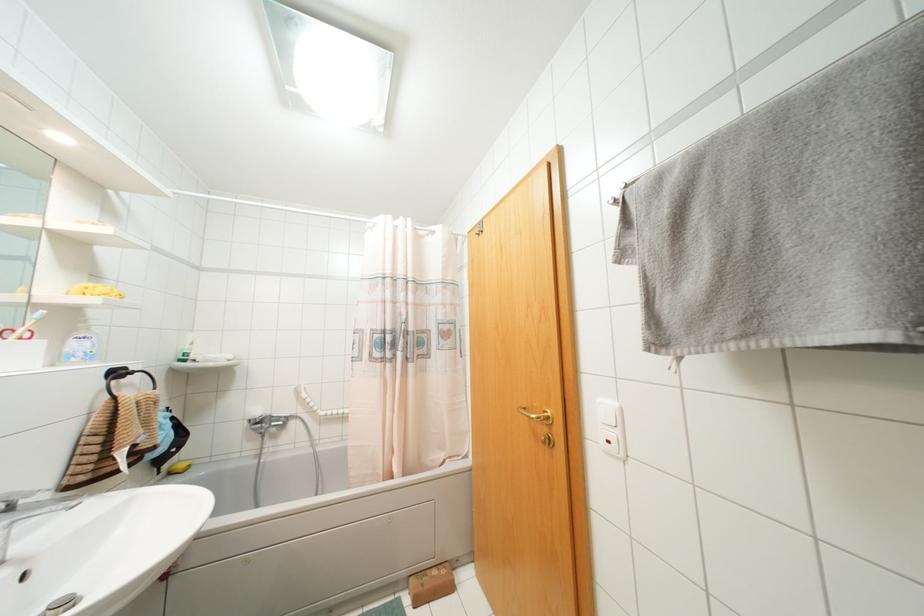
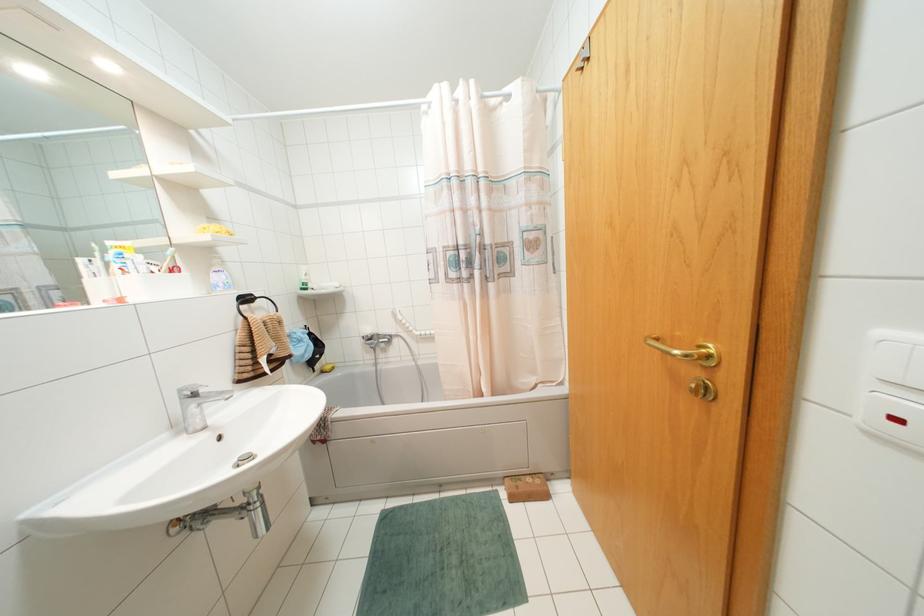
First-person continuous shooting, in which direction is the camera rotating?

The rotation direction of the camera is left-down.